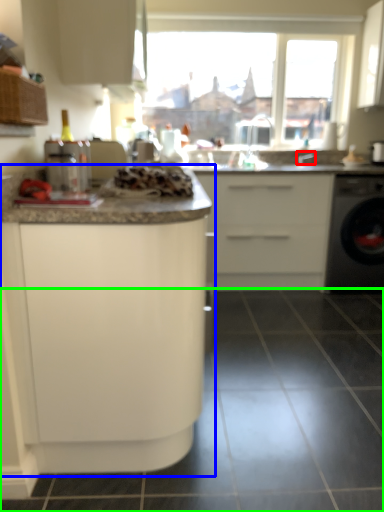
Question: Which is nearer to the faucet (highlighted by a red box)? cabinetry (highlighted by a blue box) or tile (highlighted by a green box).

Choices:
 (A) cabinetry
 (B) tile

Answer: (B)